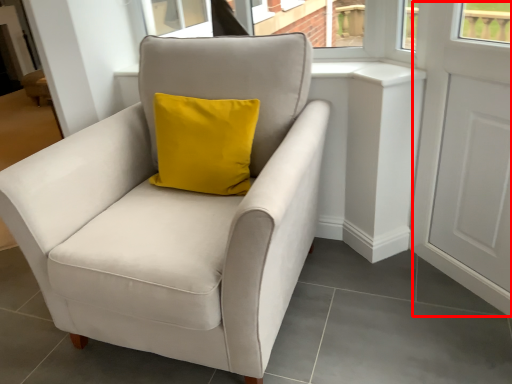
Question: From the image's perspective, what is the correct spatial relationship of screen door (annotated by the red box) in relation to chair?

Choices:
 (A) below
 (B) above

Answer: (B)